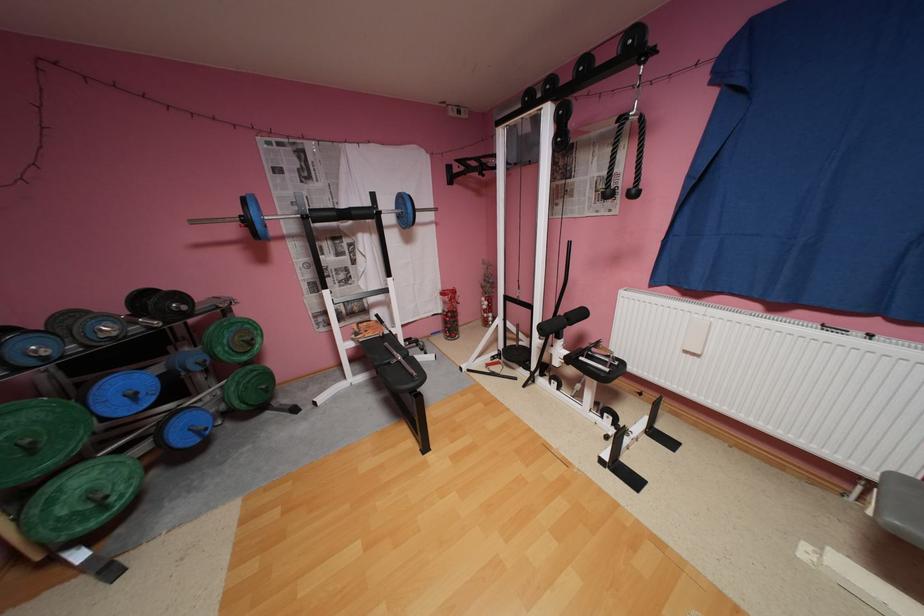
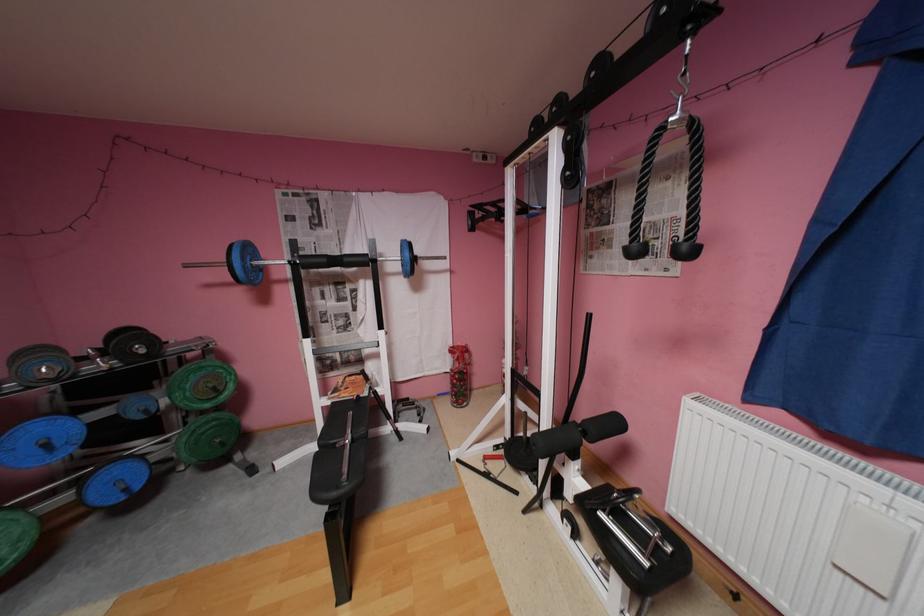
The point at (590, 313) is marked in the first image. Where is the corresponding point in the second image?

(624, 424)